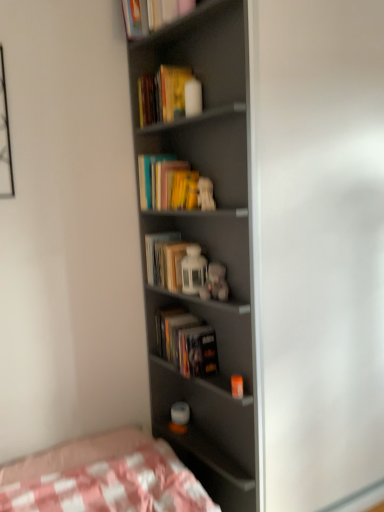
Question: Considering the relative positions of hardcover books at center, the 3th paperback book from the bottom, and hardcover books at center, marked as the 1th book in a bottom-to-top arrangement, in the image provided, is hardcover books at center, the 3th paperback book from the bottom, to the left or to the right of hardcover books at center, marked as the 1th book in a bottom-to-top arrangement,?

Choices:
 (A) right
 (B) left

Answer: (B)

Question: Is hardcover books at center, placed as the 2th paperback book when sorted from top to bottom, taller or shorter than hardcover books at center, arranged as the second book when viewed from the top?

Choices:
 (A) short
 (B) tall

Answer: (B)

Question: Which of these objects is positioned closest to the white matte figurine at center, the third toy ordered from the bottom?

Choices:
 (A) hardcover book at upper center, which ranks as the 2th book in bottom-to-top order
 (B) matte gray bookcase at center
 (C) matte gray screen door at center
 (D) fluffy white teddy bear at center, which appears as the third toy when viewed from the top
 (E) hardcover book at upper center, which appears as the 1th paperback book when viewed from the top

Answer: (D)

Question: Estimate the real-world distances between objects in this image. Which object is closer to the hardcover book at center, arranged as the second paperback book when ordered from the bottom?

Choices:
 (A) matte gray bookcase at center
 (B) hardcover book at upper center, which appears as the 1th paperback book when viewed from the top
 (C) matte gray screen door at center
 (D) white matte figurine at center, which is the first toy in top-to-bottom order
 (E) hardcover books at center, marked as the 1th book in a bottom-to-top arrangement

Answer: (E)